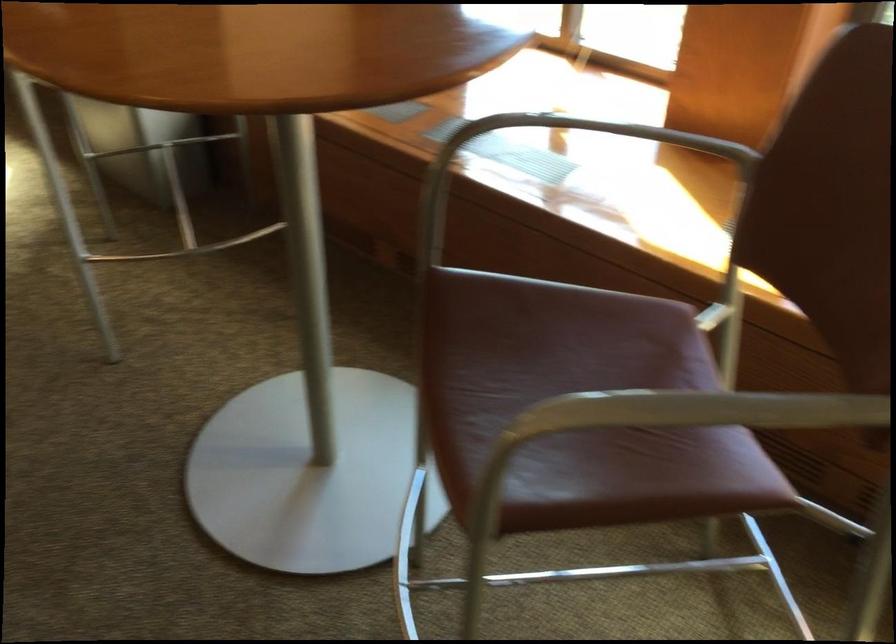
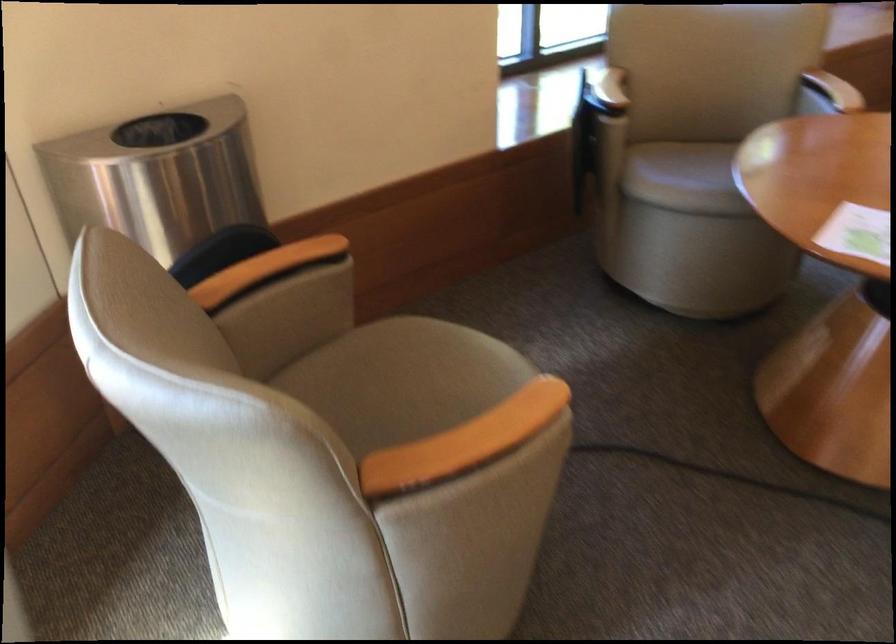
The images are taken continuously from a first-person perspective. In which direction is your viewpoint rotating?

The camera's rotation is toward right-down.